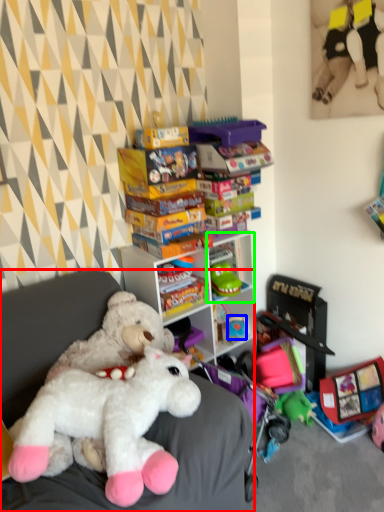
Question: Which object is the farthest from furniture (highlighted by a red box)? Choose among these: toy (highlighted by a blue box) or shelf (highlighted by a green box).

Choices:
 (A) toy
 (B) shelf

Answer: (A)